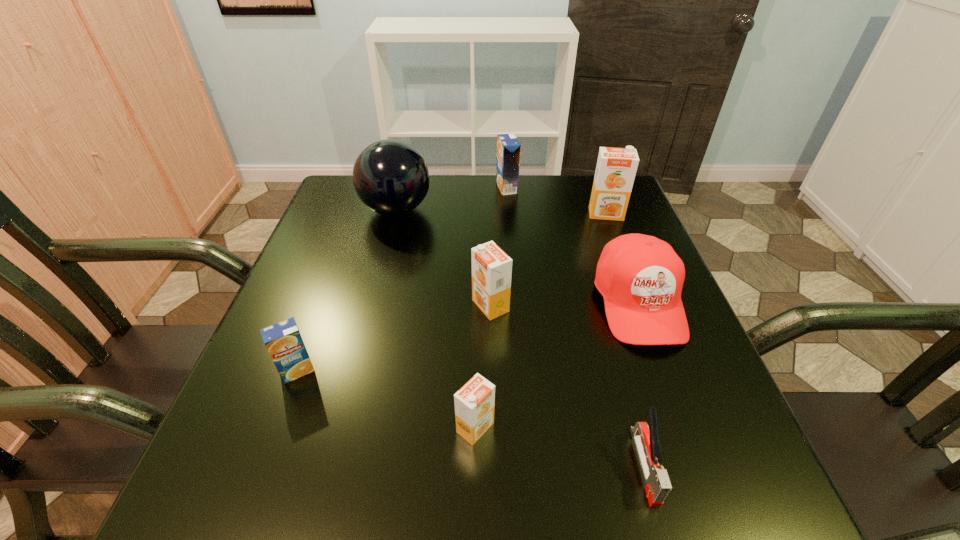
The image size is (960, 540). Find the location of `bowling ball`. bowling ball is located at coordinates (390, 177).

At what (x,y) coordinates should I click in order to perform the action: click on the farthest orange orange juice. Please return your answer as a coordinate pair (x, y). This screenshot has height=540, width=960. Looking at the image, I should click on (616, 168).

The image size is (960, 540). Find the location of `the tallest orange juice`. the tallest orange juice is located at coordinates (616, 168).

The height and width of the screenshot is (540, 960). Identify the location of the second biggest orange orange juice. (491, 267).

Where is `the third farthest orange juice`? the third farthest orange juice is located at coordinates (491, 267).

The height and width of the screenshot is (540, 960). What are the coordinates of `the farthest orange juice` in the screenshot? It's located at (508, 147).

Find the location of a particular element. The width and height of the screenshot is (960, 540). the right blue orange_juice is located at coordinates (508, 147).

Where is `baseball cap`? baseball cap is located at coordinates (640, 277).

You are a GUI agent. You are given a task and a screenshot of the screen. Output one action in this format:
    pyautogui.click(x=<x>, y=<y>)
    Task: Click on the left blue orange_juice
    The height and width of the screenshot is (540, 960).
    Given the screenshot: What is the action you would take?
    pyautogui.click(x=283, y=341)

Where is `the smaller blue orange_juice`? Image resolution: width=960 pixels, height=540 pixels. the smaller blue orange_juice is located at coordinates (283, 341).